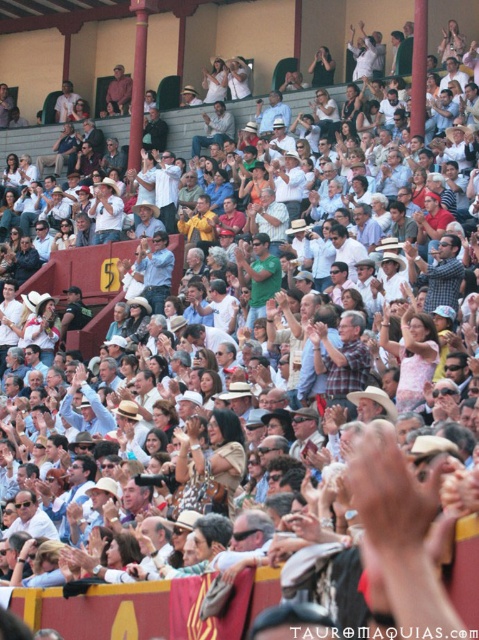
You are an event organizer planning to distribute free hats to attendees. You have two shirts in sight, the matte blue shirt at center and the matte brown shirt at upper center. Which shirt is wider?

The matte blue shirt at center is wider than the matte brown shirt at upper center.